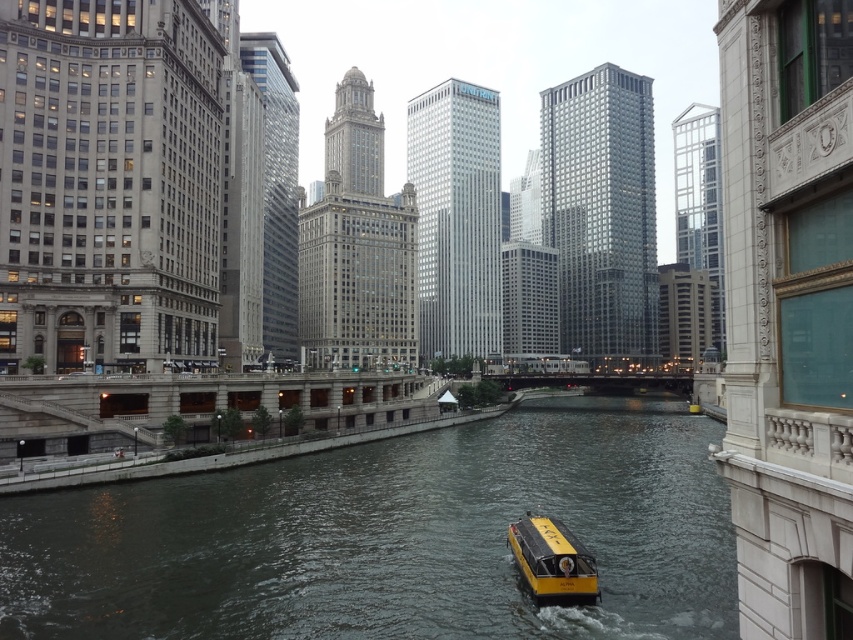
Question: Can you confirm if dark gray water at center is positioned to the right of yellow matte boat at center?

Choices:
 (A) no
 (B) yes

Answer: (A)

Question: Which object appears closest to the camera in this image?

Choices:
 (A) yellow matte boat at center
 (B) dark gray water at center

Answer: (B)

Question: Can you confirm if dark gray water at center is bigger than yellow matte boat at center?

Choices:
 (A) yes
 (B) no

Answer: (A)

Question: Which object is farther from the camera taking this photo?

Choices:
 (A) yellow matte boat at center
 (B) dark gray water at center

Answer: (A)

Question: Does dark gray water at center have a larger size compared to yellow matte boat at center?

Choices:
 (A) yes
 (B) no

Answer: (A)